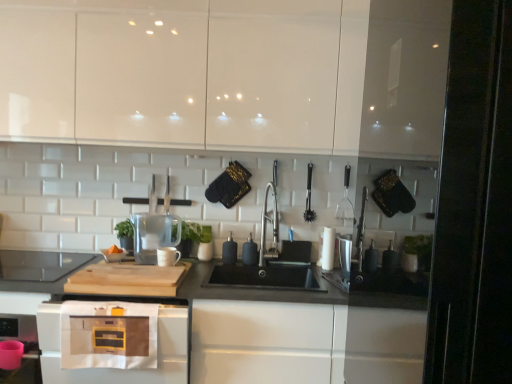
Question: Considering the relative sizes of natural wood cutting board at center and transparent glass pitcher at center, which is the 1th appliance from left to right, in the image provided, is natural wood cutting board at center wider than transparent glass pitcher at center, which is the 1th appliance from left to right,?

Choices:
 (A) yes
 (B) no

Answer: (A)

Question: Considering the relative sizes of natural wood cutting board at center and transparent glass pitcher at center, which is the 1th appliance from left to right, in the image provided, is natural wood cutting board at center taller than transparent glass pitcher at center, which is the 1th appliance from left to right,?

Choices:
 (A) no
 (B) yes

Answer: (A)

Question: Considering the relative sizes of natural wood cutting board at center and transparent glass pitcher at center, the sixth appliance when ordered from right to left, in the image provided, is natural wood cutting board at center smaller than transparent glass pitcher at center, the sixth appliance when ordered from right to left,?

Choices:
 (A) yes
 (B) no

Answer: (B)

Question: From the image's perspective, does natural wood cutting board at center appear higher than transparent glass pitcher at center, the sixth appliance when ordered from right to left?

Choices:
 (A) no
 (B) yes

Answer: (A)

Question: From a real-world perspective, is natural wood cutting board at center physically above transparent glass pitcher at center, which is the 1th appliance from left to right?

Choices:
 (A) yes
 (B) no

Answer: (B)

Question: From the image's perspective, is satin nickel faucet at center positioned above or below natural wood cutting board at center?

Choices:
 (A) above
 (B) below

Answer: (A)

Question: Considering the relative positions of satin nickel faucet at center and natural wood cutting board at center in the image provided, is satin nickel faucet at center to the left or to the right of natural wood cutting board at center?

Choices:
 (A) left
 (B) right

Answer: (B)

Question: Is satin nickel faucet at center inside or outside of natural wood cutting board at center?

Choices:
 (A) outside
 (B) inside

Answer: (A)

Question: From a real-world perspective, is satin nickel faucet at center physically located above or below natural wood cutting board at center?

Choices:
 (A) below
 (B) above

Answer: (B)

Question: Is natural wood cutting board at center bigger or smaller than black matte countertop at center?

Choices:
 (A) small
 (B) big

Answer: (A)

Question: Choose the correct answer: Is natural wood cutting board at center inside black matte countertop at center or outside it?

Choices:
 (A) outside
 (B) inside

Answer: (B)

Question: From the image's perspective, is natural wood cutting board at center located above or below black matte countertop at center?

Choices:
 (A) above
 (B) below

Answer: (A)

Question: Is point (125, 269) closer or farther from the camera than point (360, 369)?

Choices:
 (A) farther
 (B) closer

Answer: (A)

Question: Would you say black rubber brush at center, acting as the 5th appliance starting from the left, is inside or outside black matte countertop at center?

Choices:
 (A) outside
 (B) inside

Answer: (A)

Question: From a real-world perspective, relative to black matte countertop at center, is black rubber brush at center, placed as the 2th appliance when sorted from right to left, vertically above or below?

Choices:
 (A) above
 (B) below

Answer: (A)